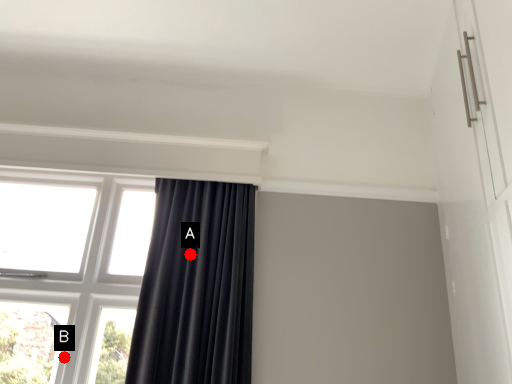
Question: Two points are circled on the image, labeled by A and B beside each circle. Which point appears closest to the camera in this image?

Choices:
 (A) A is closer
 (B) B is closer

Answer: (B)